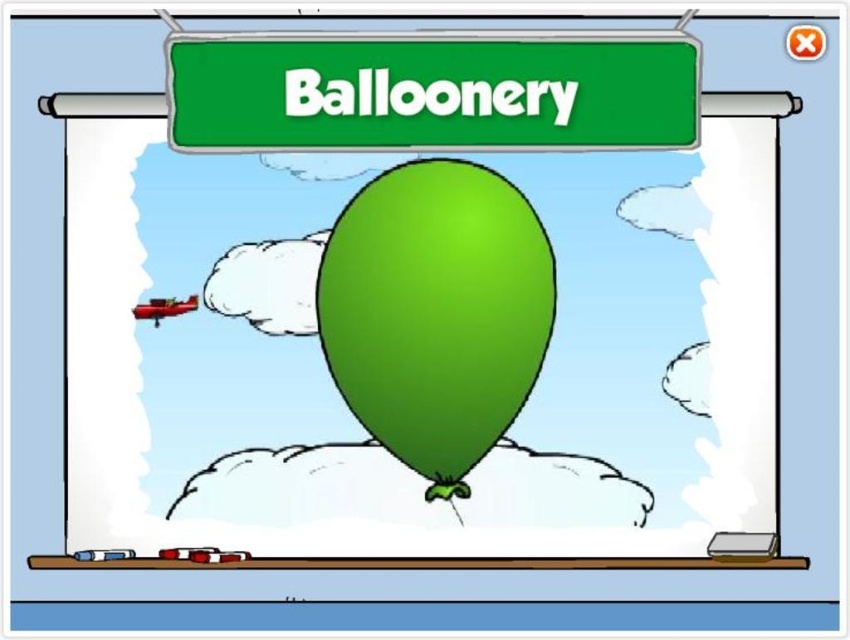
You are a customer at the Balloonery store looking for a balloon. You see the green matte signboard at upper center and the green rubber balloon at center. Which object is located to the right of the other?

The green matte signboard at upper center is positioned on the right side of green rubber balloon at center.

You are a customer entering the Balloonery shop and see the green matte signboard at upper center and the green rubber balloon at center. Which object is positioned higher in the image?

The green matte signboard at upper center is positioned higher than the green rubber balloon at center in the image.